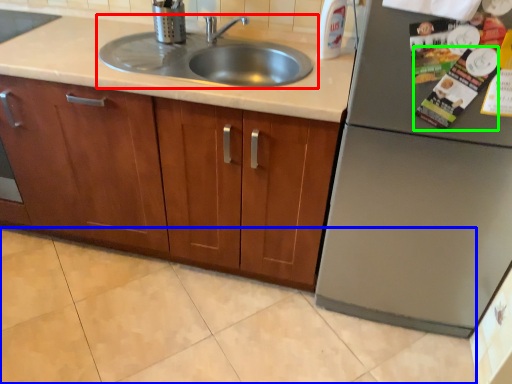
Question: Which object is the farthest from sink (highlighted by a red box)? Choose among these: granite (highlighted by a blue box) or magazine (highlighted by a green box).

Choices:
 (A) granite
 (B) magazine

Answer: (A)